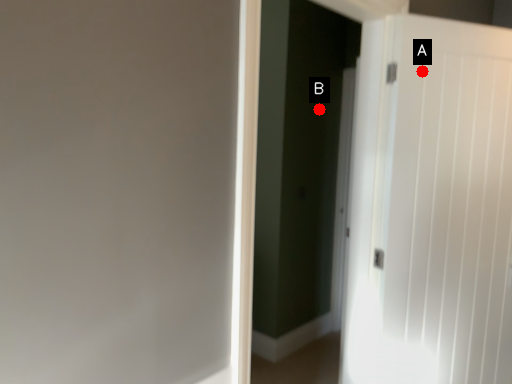
Question: Two points are circled on the image, labeled by A and B beside each circle. Which point is farther to the camera?

Choices:
 (A) A is further
 (B) B is further

Answer: (B)